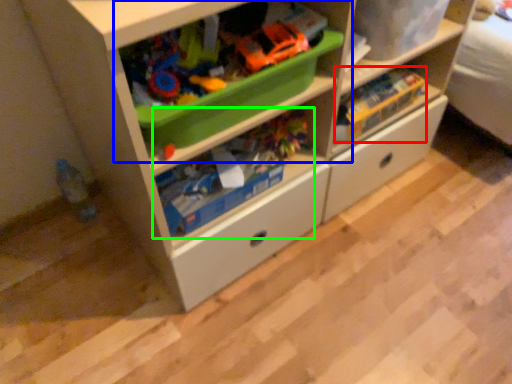
Question: Which object is positioned farthest from toy (highlighted by a red box)? Select from shelf (highlighted by a blue box) and toy (highlighted by a green box).

Choices:
 (A) shelf
 (B) toy

Answer: (A)